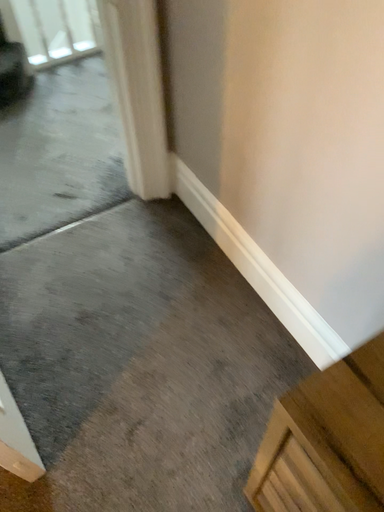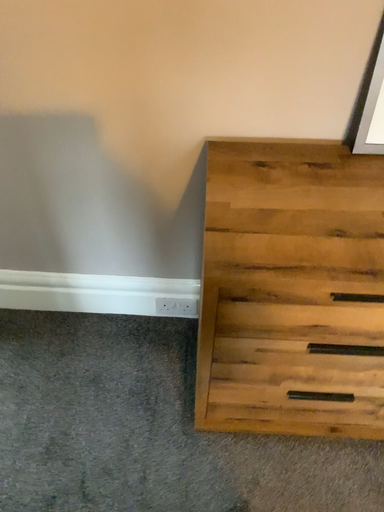
Question: Which way did the camera rotate in the video?

Choices:
 (A) rotated left
 (B) rotated right

Answer: (B)